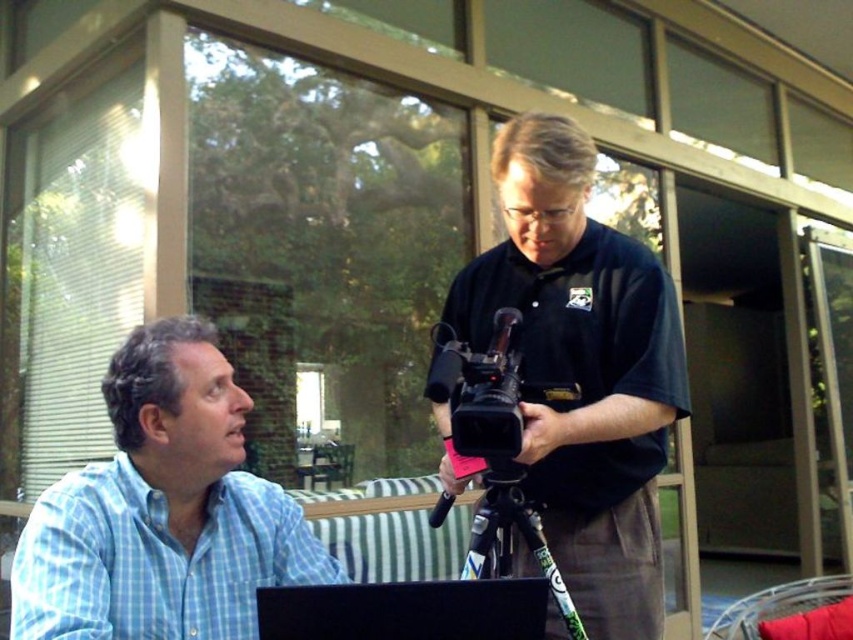
Does black matte camera at center appear under green matte tripod at center?

Actually, black matte camera at center is above green matte tripod at center.

Is point (630, 593) positioned after point (486, 556)?

Yes, it is.

Locate an element on the screen. black matte camera at center is located at coordinates (582, 369).

Does blue checkered shirt at left appear under green matte tripod at center?

No, blue checkered shirt at left is not below green matte tripod at center.

Can you confirm if blue checkered shirt at left is taller than green matte tripod at center?

In fact, blue checkered shirt at left may be shorter than green matte tripod at center.

Does point (114, 461) come in front of point (555, 577)?

That is True.

At what (x,y) coordinates should I click in order to perform the action: click on blue checkered shirt at left. Please return your answer as a coordinate pair (x, y). The image size is (853, 640). Looking at the image, I should click on (163, 509).

Who is more forward, (506,614) or (566,614)?

Positioned in front is point (506,614).

Who is positioned more to the left, black matte laptop at lower center or green matte tripod at center?

black matte laptop at lower center is more to the left.

What do you see at coordinates (405, 611) in the screenshot? This screenshot has height=640, width=853. I see `black matte laptop at lower center` at bounding box center [405, 611].

Locate an element on the screen. This screenshot has width=853, height=640. black matte laptop at lower center is located at coordinates (405, 611).